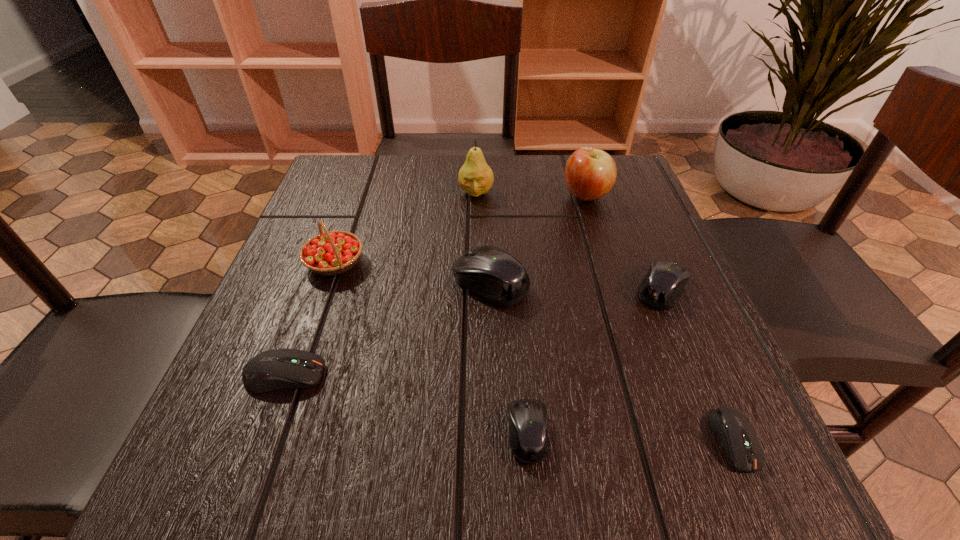
The height and width of the screenshot is (540, 960). Find the location of `vacant region between the third tallest object and the farther dark computer equipment`. vacant region between the third tallest object and the farther dark computer equipment is located at coordinates (310, 319).

The image size is (960, 540). In order to click on empty location between the biggest black mouse and the smaller dark computer equipment in this screenshot , I will do `click(612, 361)`.

The width and height of the screenshot is (960, 540). Identify the location of vacant space that is in between the smallest black mouse and the bigger dark computer equipment. (406, 404).

At what (x,y) coordinates should I click in order to perform the action: click on object that can be found as the fifth closest to the tallest computer equipment. Please return your answer as a coordinate pair (x, y). The width and height of the screenshot is (960, 540). Looking at the image, I should click on (661, 288).

Identify which object is located as the third nearest to the nearer dark computer equipment. Please provide its 2D coordinates. Your answer should be formatted as a tuple, i.e. [(x, y)], where the tuple contains the x and y coordinates of a point satisfying the conditions above.

[(493, 274)]

In order to click on the closest computer equipment to the rightmost black mouse in this screenshot , I will do `click(735, 432)`.

You are a GUI agent. You are given a task and a screenshot of the screen. Output one action in this format:
    pyautogui.click(x=<x>, y=<y>)
    Task: Click on the computer equipment that is the fourth closest to the smallest black mouse
    This screenshot has width=960, height=540.
    Given the screenshot: What is the action you would take?
    pyautogui.click(x=275, y=369)

Select which black mouse appears as the third closest to the strawberry. Please provide its 2D coordinates. Your answer should be formatted as a tuple, i.e. [(x, y)], where the tuple contains the x and y coordinates of a point satisfying the conditions above.

[(661, 288)]

Where is `black mouse that stands as the second closest to the sixth shortest object`? The image size is (960, 540). black mouse that stands as the second closest to the sixth shortest object is located at coordinates (528, 418).

Locate an element on the screen. The height and width of the screenshot is (540, 960). free spot that satisfies the following two spatial constraints: 1. on the front side of the pear; 2. on the button of the farther dark computer equipment is located at coordinates (474, 375).